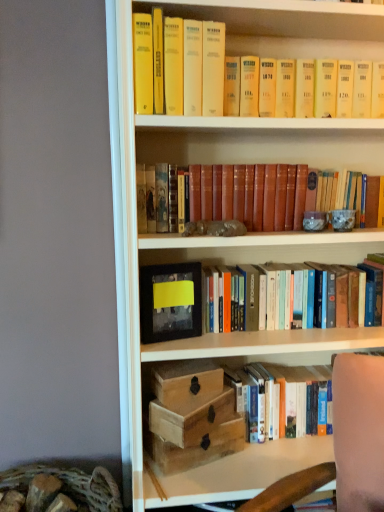
Question: Is point (144, 322) positioned closer to the camera than point (311, 425)?

Choices:
 (A) farther
 (B) closer

Answer: (B)

Question: Which is correct: matte black picture frame at center is inside hardcover book at lower right, the third book viewed from the top, or outside of it?

Choices:
 (A) outside
 (B) inside

Answer: (A)

Question: Which object is positioned farthest from the hardcover books at center, arranged as the 2th book when ordered from the bottom?

Choices:
 (A) wooden box at center
 (B) hardcover book at lower right, positioned as the 1th book in bottom-to-top order
 (C) leather-bound book at center, acting as the 1th book starting from the top
 (D) matte black picture frame at center
 (E) wooden box at lower center, the 1th box positioned from the top

Answer: (E)

Question: Which of these objects is positioned farthest from the wooden box at center?

Choices:
 (A) matte black picture frame at center
 (B) hardcover book at lower right, the third book viewed from the top
 (C) hardcover books at center, placed as the second book when sorted from top to bottom
 (D) wooden box at center, the 2th box in the top-to-bottom sequence
 (E) leather-bound book at center, acting as the 1th book starting from the top

Answer: (E)